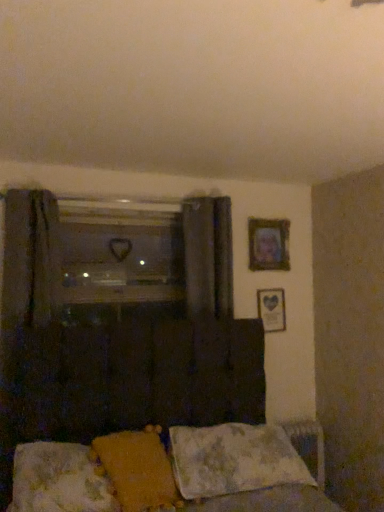
In order to face transparent glass window at center, should I rotate leftwards or rightwards?

Turn left by 8.794 degrees to look at transparent glass window at center.

Describe the element at coordinates (120, 252) in the screenshot. Image resolution: width=384 pixels, height=512 pixels. I see `transparent glass window at center` at that location.

The image size is (384, 512). What are the coordinates of `wooden picture frame at upper right, which is counted as the second picture frame, starting from the bottom` in the screenshot? It's located at (268, 244).

Describe the element at coordinates (234, 459) in the screenshot. This screenshot has width=384, height=512. I see `fluffy white pillow at lower center, the 3th pillow when ordered from left to right` at that location.

Describe the element at coordinates (131, 380) in the screenshot. I see `fluffy fabric bed at lower center` at that location.

How much space does wooden framed picture at upper right, which ranks as the 2th picture frame in top-to-bottom order, occupy horizontally?

The width of wooden framed picture at upper right, which ranks as the 2th picture frame in top-to-bottom order, is 1.45 inches.

Describe the element at coordinates (59, 480) in the screenshot. I see `fluffy white pillow at lower center, which ranks as the 1th pillow in left-to-right order` at that location.

This screenshot has width=384, height=512. What are the coordinates of `transparent glass window at center` in the screenshot? It's located at (120, 252).

Considering the sizes of objects fluffy white pillow at lower center, the first pillow when ordered from right to left, and fluffy white pillow at lower center, which ranks as the 1th pillow in left-to-right order, in the image provided, who is smaller, fluffy white pillow at lower center, the first pillow when ordered from right to left, or fluffy white pillow at lower center, which ranks as the 1th pillow in left-to-right order,?

Smaller between the two is fluffy white pillow at lower center, which ranks as the 1th pillow in left-to-right order.

Could you tell me if fluffy white pillow at lower center, the first pillow when ordered from right to left, is facing fluffy white pillow at lower center, which ranks as the 1th pillow in left-to-right order?

No, fluffy white pillow at lower center, the first pillow when ordered from right to left, is not oriented towards fluffy white pillow at lower center, which ranks as the 1th pillow in left-to-right order.

Is fluffy white pillow at lower center, the 3th pillow when ordered from left to right, next to fluffy white pillow at lower center, which ranks as the 1th pillow in left-to-right order?

fluffy white pillow at lower center, the 3th pillow when ordered from left to right, and fluffy white pillow at lower center, which ranks as the 1th pillow in left-to-right order, are not in contact.

Is fluffy white pillow at lower center, the first pillow when ordered from right to left, next to wooden framed picture at upper right, which ranks as the 2th picture frame in top-to-bottom order?

fluffy white pillow at lower center, the first pillow when ordered from right to left, is not next to wooden framed picture at upper right, which ranks as the 2th picture frame in top-to-bottom order, and they're not touching.

In the image, is fluffy white pillow at lower center, the first pillow when ordered from right to left, on the left side or the right side of wooden framed picture at upper right, which ranks as the 2th picture frame in top-to-bottom order?

fluffy white pillow at lower center, the first pillow when ordered from right to left, is to the left of wooden framed picture at upper right, which ranks as the 2th picture frame in top-to-bottom order.

What's the angular difference between fluffy white pillow at lower center, the 3th pillow when ordered from left to right, and wooden framed picture at upper right, which appears as the 1th picture frame when ordered from the bottom,'s facing directions?

There is a 2.29-degree angle between the facing directions of fluffy white pillow at lower center, the 3th pillow when ordered from left to right, and wooden framed picture at upper right, which appears as the 1th picture frame when ordered from the bottom.

Image resolution: width=384 pixels, height=512 pixels. Find the location of `the 2nd picture frame behind the fluffy white pillow at lower center, the 3th pillow when ordered from left to right`. the 2nd picture frame behind the fluffy white pillow at lower center, the 3th pillow when ordered from left to right is located at coordinates (272, 309).

Is yellow fabric pillow at lower center, marked as the 2th pillow in a right-to-left arrangement, a part of dark gray fabric curtain at center?

No, dark gray fabric curtain at center does not contain yellow fabric pillow at lower center, marked as the 2th pillow in a right-to-left arrangement.

Consider the image. How far apart are dark gray fabric curtain at center and yellow fabric pillow at lower center, placed as the second pillow when sorted from left to right?

The distance of dark gray fabric curtain at center from yellow fabric pillow at lower center, placed as the second pillow when sorted from left to right, is 3.37 feet.

Is dark gray fabric curtain at center shorter than yellow fabric pillow at lower center, placed as the second pillow when sorted from left to right?

In fact, dark gray fabric curtain at center may be taller than yellow fabric pillow at lower center, placed as the second pillow when sorted from left to right.

Looking at their sizes, would you say dark gray fabric curtain at center is wider or thinner than yellow fabric pillow at lower center, placed as the second pillow when sorted from left to right?

dark gray fabric curtain at center is thinner than yellow fabric pillow at lower center, placed as the second pillow when sorted from left to right.

Does transparent glass window at center contain wooden framed picture at upper right, which appears as the 1th picture frame when ordered from the bottom?

That's incorrect, wooden framed picture at upper right, which appears as the 1th picture frame when ordered from the bottom, is not inside transparent glass window at center.

Where is `window above the wooden framed picture at upper right, which appears as the 1th picture frame when ordered from the bottom (from the image's perspective)`? window above the wooden framed picture at upper right, which appears as the 1th picture frame when ordered from the bottom (from the image's perspective) is located at coordinates (120, 252).

Is point (167, 260) farther from camera compared to point (257, 292)?

No, it is in front of (257, 292).

Based on the photo, considering the positions of objects wooden framed picture at upper right, which appears as the 1th picture frame when ordered from the bottom, and wooden picture frame at upper right, positioned as the first picture frame in top-to-bottom order, in the image provided, who is more to the right, wooden framed picture at upper right, which appears as the 1th picture frame when ordered from the bottom, or wooden picture frame at upper right, positioned as the first picture frame in top-to-bottom order,?

From the viewer's perspective, wooden framed picture at upper right, which appears as the 1th picture frame when ordered from the bottom, appears more on the right side.

Could you tell me if wooden framed picture at upper right, which appears as the 1th picture frame when ordered from the bottom, is turned towards wooden picture frame at upper right, which is counted as the second picture frame, starting from the bottom?

No, wooden framed picture at upper right, which appears as the 1th picture frame when ordered from the bottom, is not oriented towards wooden picture frame at upper right, which is counted as the second picture frame, starting from the bottom.

From the image's perspective, is wooden framed picture at upper right, which ranks as the 2th picture frame in top-to-bottom order, located above or below wooden picture frame at upper right, positioned as the first picture frame in top-to-bottom order?

From the image's perspective, wooden framed picture at upper right, which ranks as the 2th picture frame in top-to-bottom order, appears below wooden picture frame at upper right, positioned as the first picture frame in top-to-bottom order.

Image resolution: width=384 pixels, height=512 pixels. Find the location of `picture frame below the wooden picture frame at upper right, which is counted as the second picture frame, starting from the bottom (from the image's perspective)`. picture frame below the wooden picture frame at upper right, which is counted as the second picture frame, starting from the bottom (from the image's perspective) is located at coordinates (272, 309).

Is fluffy fabric bed at lower center wider or thinner than transparent glass window at center?

Clearly, fluffy fabric bed at lower center has more width compared to transparent glass window at center.

Is there a large distance between fluffy fabric bed at lower center and transparent glass window at center?

They are positioned close to each other.

Who is bigger, fluffy fabric bed at lower center or transparent glass window at center?

fluffy fabric bed at lower center is bigger.

Choose the correct answer: Is fluffy fabric bed at lower center inside transparent glass window at center or outside it?

fluffy fabric bed at lower center is not inside transparent glass window at center, it's outside.

Locate an element on the screen. The width and height of the screenshot is (384, 512). the 3rd pillow positioned below the transparent glass window at center (from the image's perspective) is located at coordinates (234, 459).

How different are the orientations of transparent glass window at center and fluffy white pillow at lower center, the 3th pillow when ordered from left to right, in degrees?

There is a 1.68-degree angle between the facing directions of transparent glass window at center and fluffy white pillow at lower center, the 3th pillow when ordered from left to right.

Between point (138, 278) and point (223, 494), which one is positioned in front?

The point (223, 494) is in front.

Is transparent glass window at center spatially inside fluffy white pillow at lower center, the 3th pillow when ordered from left to right, or outside of it?

The correct answer is: outside.

Identify the location of pillow that is the 1st object located above the fluffy white pillow at lower center, the 3th pillow when ordered from left to right (from the image's perspective). Image resolution: width=384 pixels, height=512 pixels. (59, 480).

Starting from the fluffy white pillow at lower center, the 3th pillow when ordered from left to right, which picture frame is the 2nd one behind? Please provide its 2D coordinates.

[(272, 309)]

Looking at the image, which one is located further to fluffy white pillow at lower center, the 3th pillow when ordered from left to right, yellow fabric pillow at lower center, marked as the 2th pillow in a right-to-left arrangement, or wooden framed picture at upper right, which appears as the 1th picture frame when ordered from the bottom?

The object further to fluffy white pillow at lower center, the 3th pillow when ordered from left to right, is wooden framed picture at upper right, which appears as the 1th picture frame when ordered from the bottom.

Estimate the real-world distances between objects in this image. Which object is closer to fluffy fabric bed at lower center, dark gray fabric curtain at center or wooden framed picture at upper right, which appears as the 1th picture frame when ordered from the bottom?

The object closer to fluffy fabric bed at lower center is dark gray fabric curtain at center.

Considering their positions, is yellow fabric pillow at lower center, marked as the 2th pillow in a right-to-left arrangement, positioned further to wooden framed picture at upper right, which appears as the 1th picture frame when ordered from the bottom, than wooden picture frame at upper right, which is counted as the second picture frame, starting from the bottom?

yellow fabric pillow at lower center, marked as the 2th pillow in a right-to-left arrangement, is further to wooden framed picture at upper right, which appears as the 1th picture frame when ordered from the bottom.

When comparing their distances from fluffy white pillow at lower center, which ranks as the 3th pillow in right-to-left order, does fluffy fabric bed at lower center or yellow fabric pillow at lower center, placed as the second pillow when sorted from left to right, seem closer?

yellow fabric pillow at lower center, placed as the second pillow when sorted from left to right, is positioned closer to the anchor fluffy white pillow at lower center, which ranks as the 3th pillow in right-to-left order.

Considering their positions, is transparent glass window at center positioned further to fluffy white pillow at lower center, the 3th pillow when ordered from left to right, than wooden framed picture at upper right, which ranks as the 2th picture frame in top-to-bottom order?

transparent glass window at center is further to fluffy white pillow at lower center, the 3th pillow when ordered from left to right.

From the image, which object appears to be nearer to transparent glass window at center, wooden framed picture at upper right, which ranks as the 2th picture frame in top-to-bottom order, or fluffy white pillow at lower center, the 3th pillow when ordered from left to right?

Based on the image, wooden framed picture at upper right, which ranks as the 2th picture frame in top-to-bottom order, appears to be nearer to transparent glass window at center.

Considering their positions, is fluffy white pillow at lower center, which ranks as the 3th pillow in right-to-left order, positioned closer to fluffy white pillow at lower center, the 3th pillow when ordered from left to right, than yellow fabric pillow at lower center, placed as the second pillow when sorted from left to right?

Among the two, yellow fabric pillow at lower center, placed as the second pillow when sorted from left to right, is located nearer to fluffy white pillow at lower center, the 3th pillow when ordered from left to right.

Based on their spatial positions, is fluffy fabric bed at lower center or wooden framed picture at upper right, which ranks as the 2th picture frame in top-to-bottom order, closer to dark gray fabric curtain at center?

wooden framed picture at upper right, which ranks as the 2th picture frame in top-to-bottom order, is positioned closer to the anchor dark gray fabric curtain at center.

Locate an element on the screen. This screenshot has width=384, height=512. curtain between wooden picture frame at upper right, positioned as the first picture frame in top-to-bottom order, and wooden framed picture at upper right, which ranks as the 2th picture frame in top-to-bottom order, from top to bottom is located at coordinates (208, 255).

Where is `picture frame between fluffy white pillow at lower center, which ranks as the 1th pillow in left-to-right order, and wooden framed picture at upper right, which appears as the 1th picture frame when ordered from the bottom, in the front-back direction`? This screenshot has height=512, width=384. picture frame between fluffy white pillow at lower center, which ranks as the 1th pillow in left-to-right order, and wooden framed picture at upper right, which appears as the 1th picture frame when ordered from the bottom, in the front-back direction is located at coordinates (268, 244).

At what (x,y) coordinates should I click in order to perform the action: click on picture frame situated between transparent glass window at center and wooden framed picture at upper right, which appears as the 1th picture frame when ordered from the bottom, from left to right. Please return your answer as a coordinate pair (x, y). Looking at the image, I should click on point(268,244).

What are the coordinates of `picture frame located between yellow fabric pillow at lower center, placed as the second pillow when sorted from left to right, and wooden framed picture at upper right, which ranks as the 2th picture frame in top-to-bottom order, in the depth direction` in the screenshot? It's located at (268, 244).